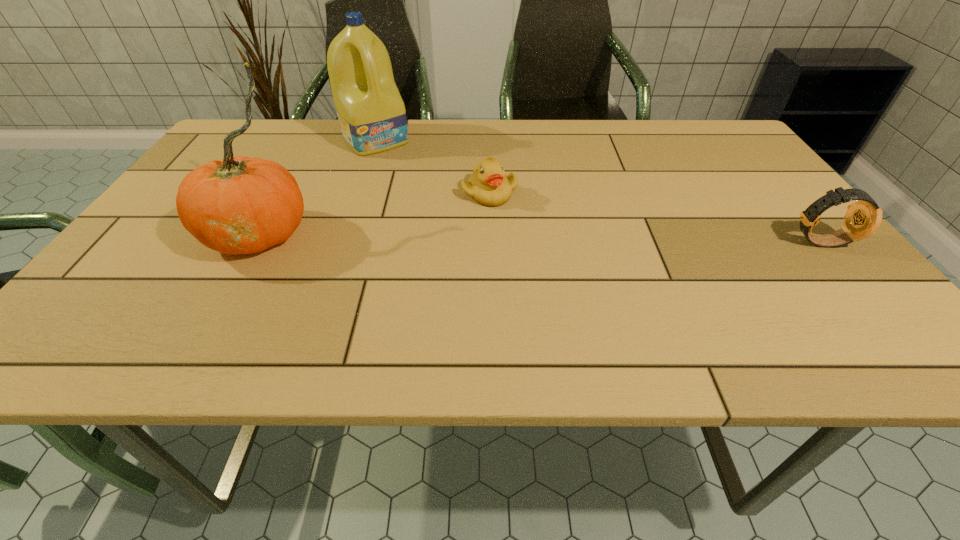
Locate an element on the screen. The image size is (960, 540). free space located 0.190m on the front-facing side of the duckling is located at coordinates (566, 247).

This screenshot has width=960, height=540. Find the location of `free location located 0.160m on the front-facing side of the duckling`. free location located 0.160m on the front-facing side of the duckling is located at coordinates (556, 240).

Find the location of a particular element. This screenshot has height=540, width=960. free location located on the front-facing side of the duckling is located at coordinates [577, 254].

Identify the location of object that is at the far edge. Image resolution: width=960 pixels, height=540 pixels. point(371,113).

Identify the location of object at the left edge. The height and width of the screenshot is (540, 960). (239, 205).

You are a GUI agent. You are given a task and a screenshot of the screen. Output one action in this format:
    pyautogui.click(x=<x>, y=<y>)
    Task: Click on the object that is at the right edge
    The image size is (960, 540).
    Given the screenshot: What is the action you would take?
    pyautogui.click(x=863, y=218)

Find the location of a particular element. The image size is (960, 540). free space at the far edge of the desktop is located at coordinates (547, 150).

Where is `vacant space at the near edge of the desktop`? This screenshot has width=960, height=540. vacant space at the near edge of the desktop is located at coordinates (752, 310).

The height and width of the screenshot is (540, 960). What are the coordinates of `blank space at the right edge of the desktop` in the screenshot? It's located at 739,179.

The height and width of the screenshot is (540, 960). Identify the location of vacant space at the far left corner of the desktop. (250, 154).